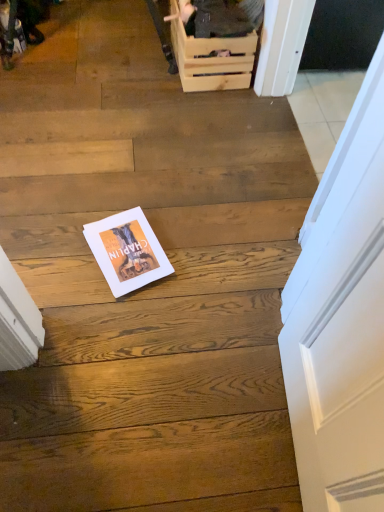
The height and width of the screenshot is (512, 384). Identify the location of unoccupied region to the right of white paper magazine at center. (194, 252).